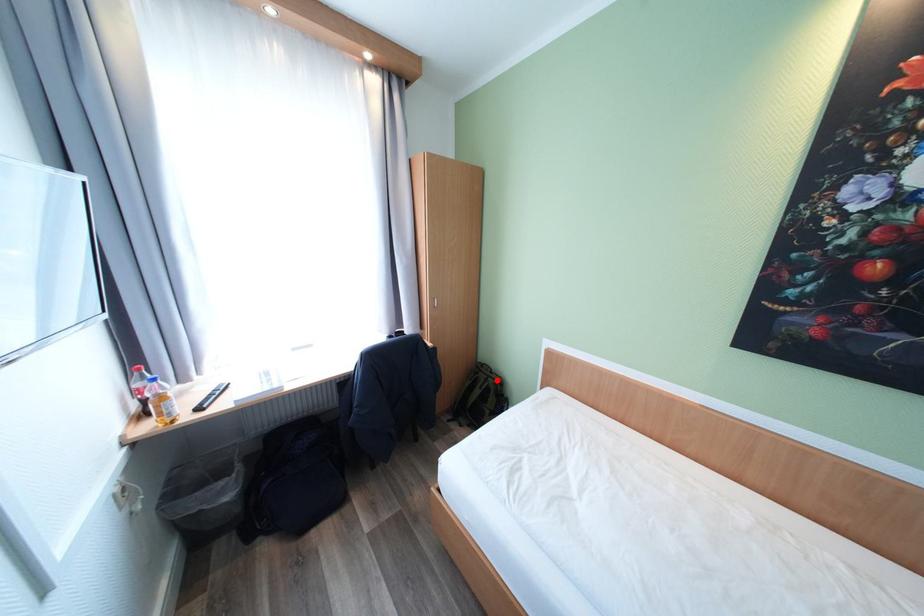
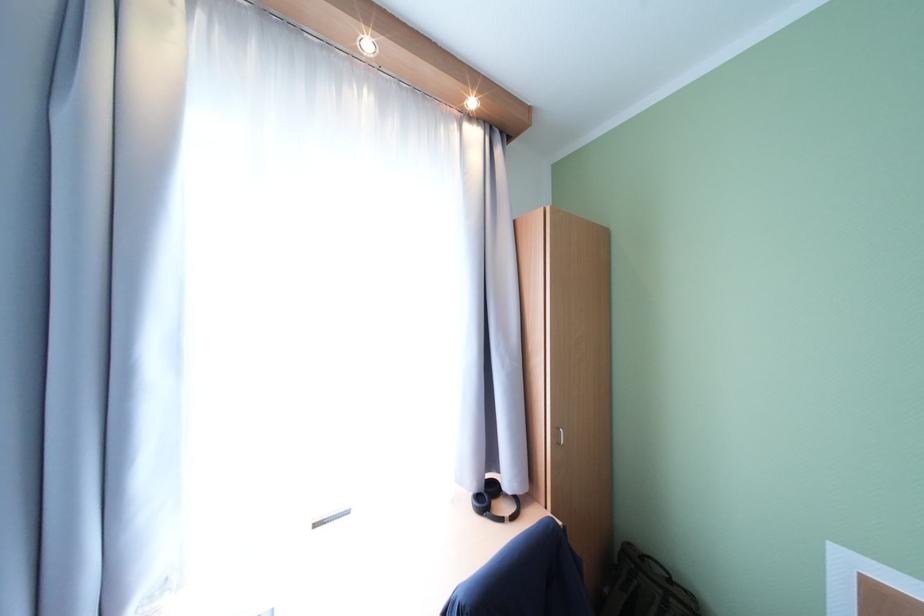
Where in the second image is the point corresponding to the highlighted location from the first image?

(679, 602)